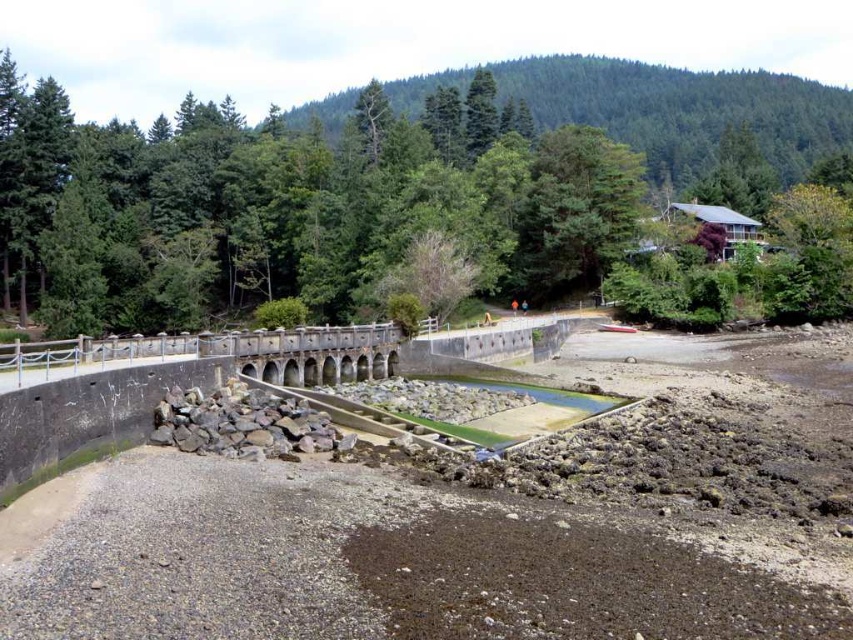
Which is behind, point (581, 154) or point (352, 340)?

Point (581, 154)

Which is in front, point (157, 324) or point (244, 369)?

Point (244, 369) is more forward.

Locate an element on the screen. The image size is (853, 640). green leafy tree at upper center is located at coordinates (386, 188).